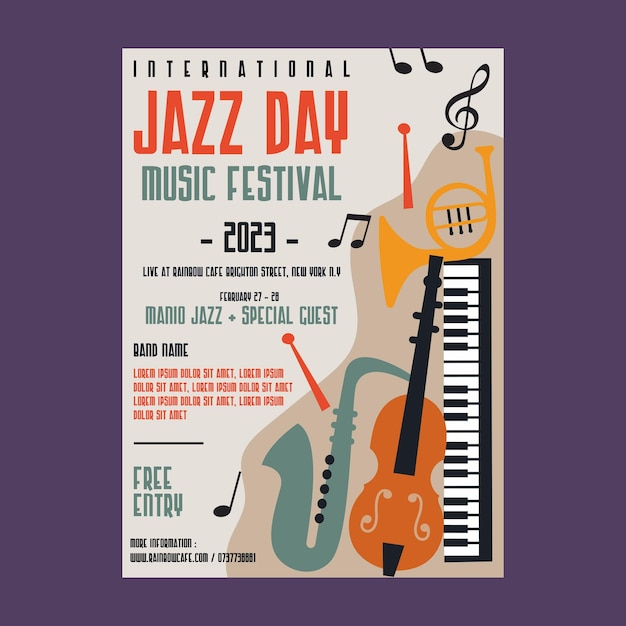
Where is `white part of poster`? The height and width of the screenshot is (626, 626). white part of poster is located at coordinates (188, 222).